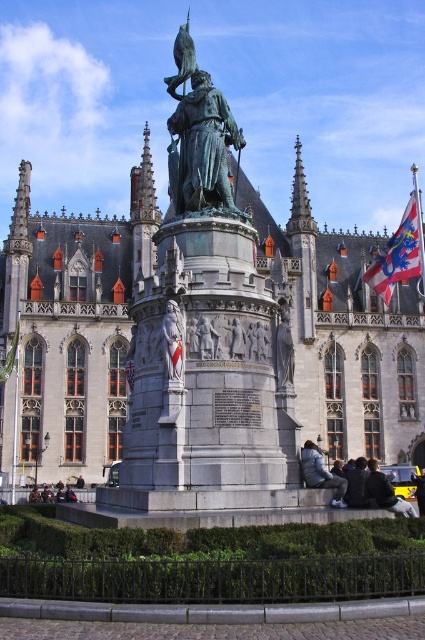
You are standing at the entrance of the historic building and notice two items in the scene. Which object, the dark gray fabric jacket at lower right or the white fabric flag at center, takes up more visual space in the image?

The dark gray fabric jacket at lower right is larger in size than the white fabric flag at center, so it takes up more visual space in the image.

You are a tour guide explaining the monument to visitors. You want to point out the bronze statue at center and the gray stone relief at center. Which one is located higher up?

The bronze statue at center is positioned over the gray stone relief at center, so the bronze statue at center is higher up.